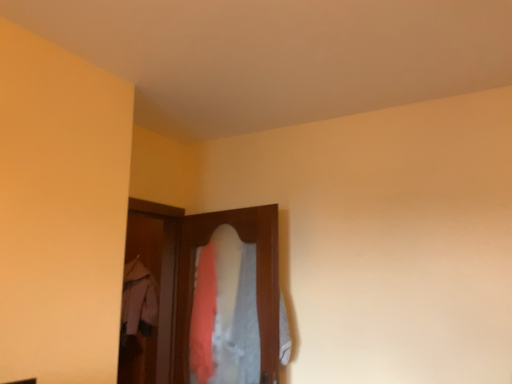
Question: Is point (158, 377) positioned closer to the camera than point (133, 296)?

Choices:
 (A) closer
 (B) farther

Answer: (A)

Question: Considering the positions of wooden screen door at center and light pink fabric coat at center in the image, is wooden screen door at center wider or thinner than light pink fabric coat at center?

Choices:
 (A) thin
 (B) wide

Answer: (A)

Question: Which object is the closest to the textured fabric closet at center?

Choices:
 (A) light pink fabric coat at center
 (B) wooden screen door at center

Answer: (B)

Question: Which of these objects is positioned farthest from the textured fabric closet at center?

Choices:
 (A) light pink fabric coat at center
 (B) wooden screen door at center

Answer: (A)